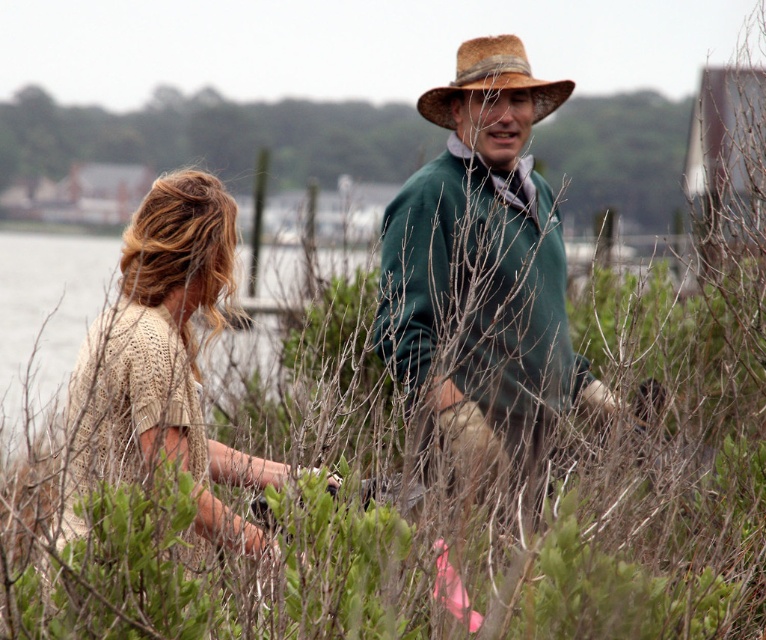
You are a photographer trying to capture both the knitted beige sweater at left and the brown straw cowboy hat at upper center in a single frame. Based on their positions, which object should you focus on first to ensure both are in the frame?

The knitted beige sweater at left is positioned under the brown straw cowboy hat at upper center, so you should focus on the brown straw cowboy hat at upper center first to ensure both are in the frame.

You are trying to decide which knitted beige sweater to take for a day by the water. The knitted beige sweater at center and the knitted beige sweater at left are both available. Which one has a larger width?

The knitted beige sweater at center might be wider than knitted beige sweater at left, so you should choose the one at center if you prefer a wider fit.

You are a photographer standing behind the two people in the scene. You want to take a picture that includes both the green matte sweater at center and the knitted beige sweater at left without any obstructions. What is the minimum distance you need to step back to ensure both sweaters are fully visible in the frame?

The green matte sweater at center and knitted beige sweater at left are 26.76 inches apart from each other. To capture both in the frame without obstructions, the photographer should step back at least 26.76 inches to ensure the entire distance between them fits within the camera frame.